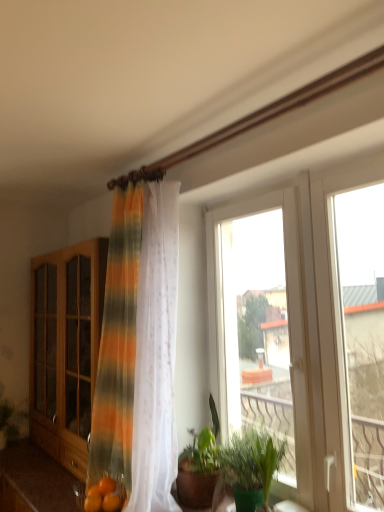
Question: Based on their positions, is orange matte citrus fruit at lower left, acting as the second citrus fruit starting from the back, located to the left or right of wooden cabinet at left?

Choices:
 (A) right
 (B) left

Answer: (A)

Question: Is point (110, 502) closer or farther from the camera than point (61, 411)?

Choices:
 (A) closer
 (B) farther

Answer: (A)

Question: Estimate the real-world distances between objects in this image. Which object is farther from the wooden cabinet at left?

Choices:
 (A) transparent glass window at right, the 3th window when ordered from left to right
 (B) orange matte citrus fruit at lower left, placed as the 1th citrus fruit when sorted from back to front
 (C) striped sheer curtain at center
 (D) orange matte citrus fruit at lower left, the 1th citrus fruit viewed from the front
 (E) green matte plant at lower left, which is counted as the 1th plant, starting from the left

Answer: (A)

Question: Estimate the real-world distances between objects in this image. Which object is closer to the wooden cabinet at left?

Choices:
 (A) orange matte citrus fruit at lower left, acting as the second citrus fruit starting from the back
 (B) white plastic window at center, marked as the 2th window in a left-to-right arrangement
 (C) transparent glass window at center, which is counted as the first window, starting from the left
 (D) green leafy plant at center, arranged as the second houseplant when viewed from the right
 (E) green leafy plant at lower right, positioned as the 2th houseplant in left-to-right order

Answer: (D)